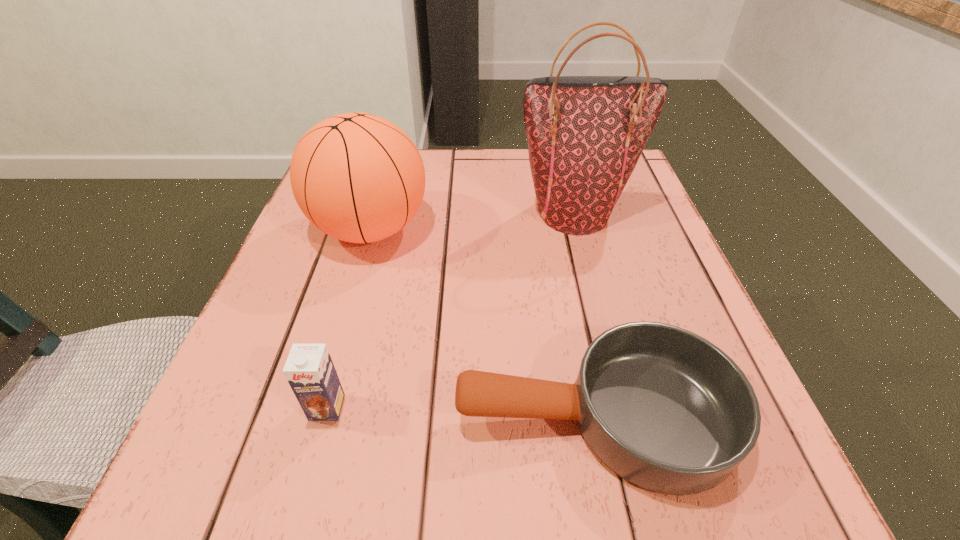
Image resolution: width=960 pixels, height=540 pixels. Identify the location of vacant space at the far edge. (426, 156).

Locate an element on the screen. free location at the near edge of the desktop is located at coordinates (594, 462).

In the image, there is a desktop. Where is `vacant space at the left edge`? The height and width of the screenshot is (540, 960). vacant space at the left edge is located at coordinates (294, 242).

Where is `free spot at the right edge of the desktop`? This screenshot has width=960, height=540. free spot at the right edge of the desktop is located at coordinates (642, 247).

You are a GUI agent. You are given a task and a screenshot of the screen. Output one action in this format:
    pyautogui.click(x=<x>, y=<y>)
    Task: Click on the blank space at the near right corner
    The width and height of the screenshot is (960, 540).
    Given the screenshot: What is the action you would take?
    pyautogui.click(x=762, y=505)

Locate an element on the screen. The width and height of the screenshot is (960, 540). vacant space in between the basketball and the shortest object is located at coordinates (482, 322).

Where is `free space between the basketball and the chocolate milk`? The width and height of the screenshot is (960, 540). free space between the basketball and the chocolate milk is located at coordinates (348, 318).

This screenshot has height=540, width=960. I want to click on vacant area between the tallest object and the chocolate milk, so click(x=450, y=310).

I want to click on vacant area that lies between the tallest object and the third tallest object, so pyautogui.click(x=450, y=310).

The image size is (960, 540). Find the location of `free space between the pan and the basketball`. free space between the pan and the basketball is located at coordinates (482, 322).